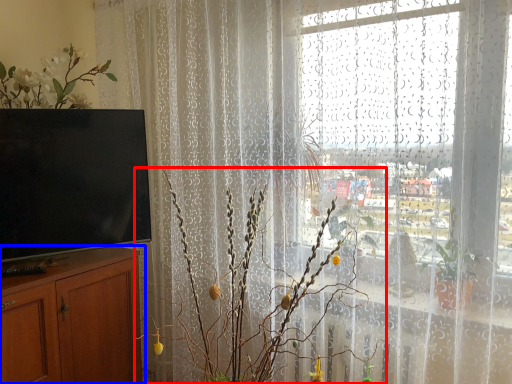
Question: Which of the following is the closest to the observer, floral arrangement (highlighted by a red box) or cabinetry (highlighted by a blue box)?

Choices:
 (A) floral arrangement
 (B) cabinetry

Answer: (A)